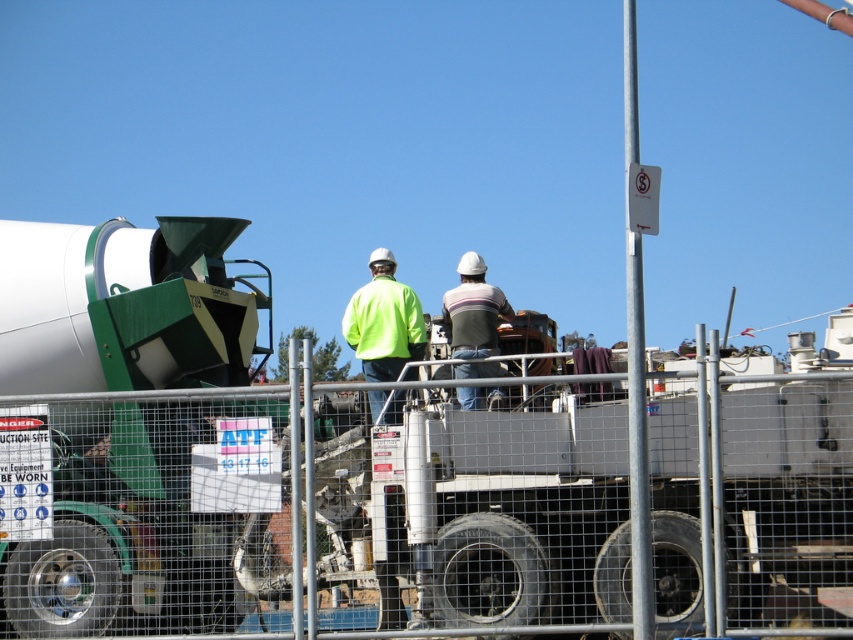
Is silver metallic pole at upper center closer to camera compared to neon yellow jacket at center?

Yes, silver metallic pole at upper center is in front of neon yellow jacket at center.

Does silver metallic pole at upper center have a smaller size compared to neon yellow jacket at center?

No, silver metallic pole at upper center is not smaller than neon yellow jacket at center.

At what (x,y) coordinates should I click in order to perform the action: click on silver metallic pole at upper center. Please return your answer as a coordinate pair (x, y). The image size is (853, 640). Looking at the image, I should click on (637, 442).

At what (x,y) coordinates should I click in order to perform the action: click on silver metallic pole at upper center. Please return your answer as a coordinate pair (x, y). Looking at the image, I should click on (637, 442).

From the picture: Does neon yellow jacket at center have a smaller size compared to striped cotton shirt at center?

No.

Where is `neon yellow jacket at center`? neon yellow jacket at center is located at coordinates (384, 321).

The height and width of the screenshot is (640, 853). Identify the location of neon yellow jacket at center. (384, 321).

Is silver metallic pole at upper center positioned in front of striped cotton shirt at center?

That is True.

Based on the photo, is silver metallic pole at upper center thinner than striped cotton shirt at center?

No.

Which is behind, point (636, 536) or point (454, 369)?

Positioned behind is point (454, 369).

This screenshot has height=640, width=853. I want to click on silver metallic pole at upper center, so click(637, 442).